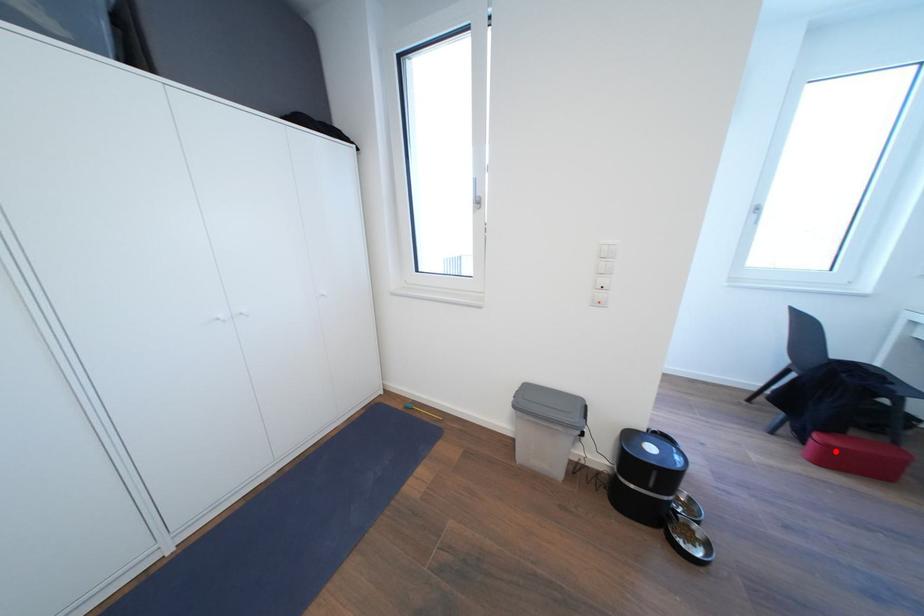
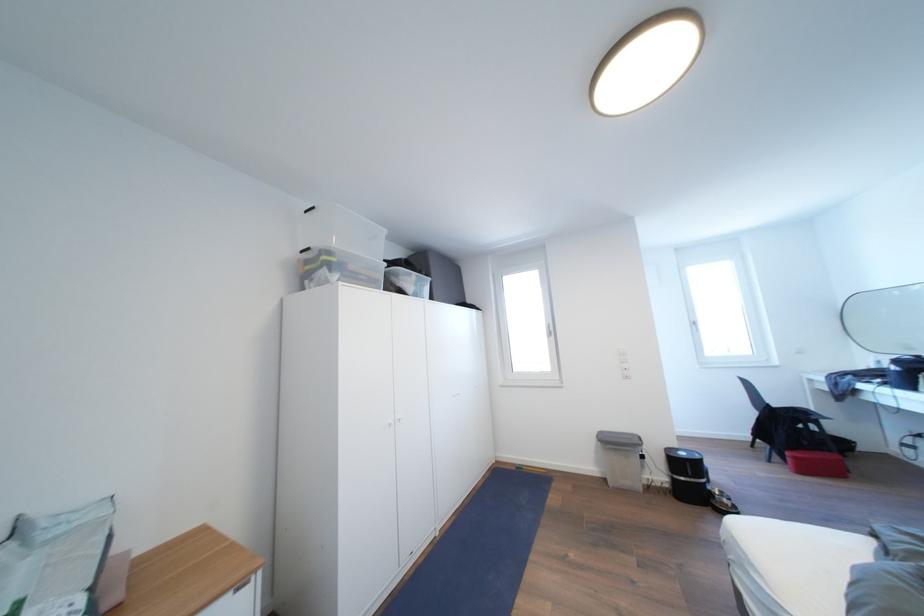
Find the pixel in the second image that matches the highlighted location in the first image.

(803, 463)